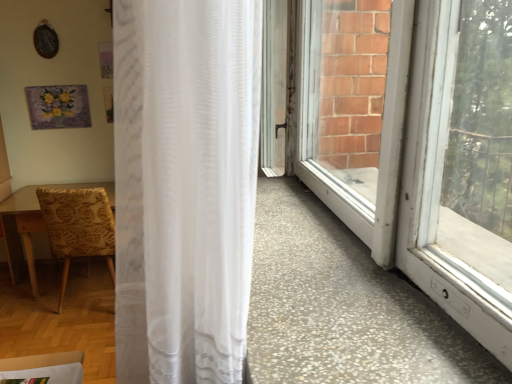
Question: Does patterned fabric chair at left appear on the left side of white sheer curtain at center?

Choices:
 (A) yes
 (B) no

Answer: (A)

Question: Is the position of patterned fabric chair at left less distant than that of white sheer curtain at center?

Choices:
 (A) yes
 (B) no

Answer: (B)

Question: From a real-world perspective, is patterned fabric chair at left physically above white sheer curtain at center?

Choices:
 (A) yes
 (B) no

Answer: (B)

Question: Can you confirm if patterned fabric chair at left is taller than white sheer curtain at center?

Choices:
 (A) yes
 (B) no

Answer: (B)

Question: Can you confirm if patterned fabric chair at left is wider than white sheer curtain at center?

Choices:
 (A) yes
 (B) no

Answer: (A)

Question: From a real-world perspective, does patterned fabric chair at left sit lower than white sheer curtain at center?

Choices:
 (A) yes
 (B) no

Answer: (A)

Question: Is white sheer curtain at center looking in the opposite direction of patterned fabric chair at left?

Choices:
 (A) no
 (B) yes

Answer: (A)

Question: Can you confirm if white sheer curtain at center is shorter than patterned fabric chair at left?

Choices:
 (A) yes
 (B) no

Answer: (B)

Question: Is white sheer curtain at center facing towards patterned fabric chair at left?

Choices:
 (A) yes
 (B) no

Answer: (B)

Question: From a real-world perspective, is white sheer curtain at center located beneath patterned fabric chair at left?

Choices:
 (A) no
 (B) yes

Answer: (A)

Question: Is white sheer curtain at center beside patterned fabric chair at left?

Choices:
 (A) no
 (B) yes

Answer: (A)

Question: Are white sheer curtain at center and patterned fabric chair at left far apart?

Choices:
 (A) yes
 (B) no

Answer: (A)

Question: Relative to white sheer curtain at center, is patterned fabric chair at left in front or behind?

Choices:
 (A) behind
 (B) front

Answer: (A)